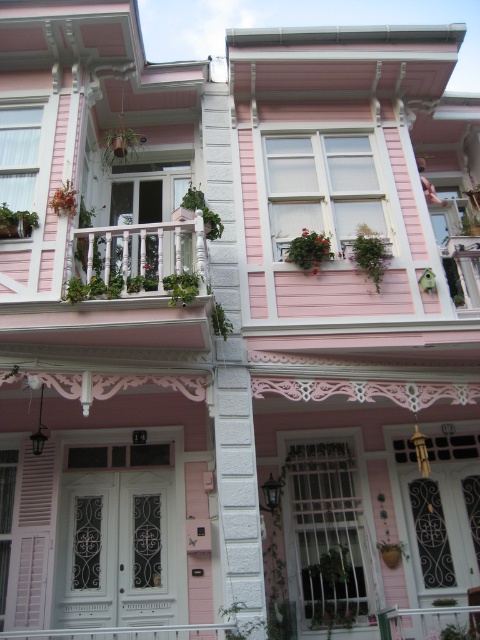
You are a painter who needs to decide which area to paint first between the white wooden balcony at center and the white wooden railing at center. Which one has a bigger surface area to paint?

The white wooden balcony at center has a larger size compared to the white wooden railing at center, so it has a bigger surface area to paint.

You are a painter standing at the base of the building. You need to paint both the white wooden balcony at center and the pink matte shutter at lower left. If your ladder can reach 8 feet, can you safely paint both objects without moving the ladder?

The white wooden balcony at center is 7.84 feet from the pink matte shutter at lower left. Since the ladder can reach 8 feet, you can safely paint both objects without moving the ladder because the distance between them is within the ladder reach.